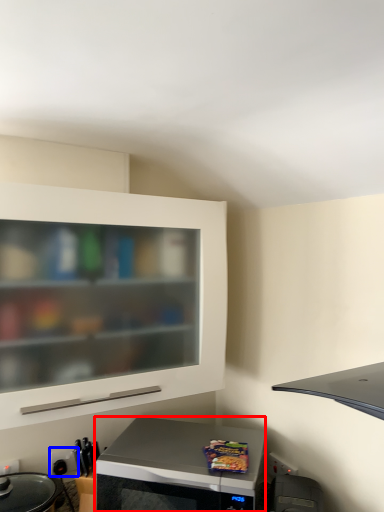
Question: Which object is closer to the camera taking this photo, microwave oven (highlighted by a red box) or electric outlet (highlighted by a blue box)?

Choices:
 (A) microwave oven
 (B) electric outlet

Answer: (A)